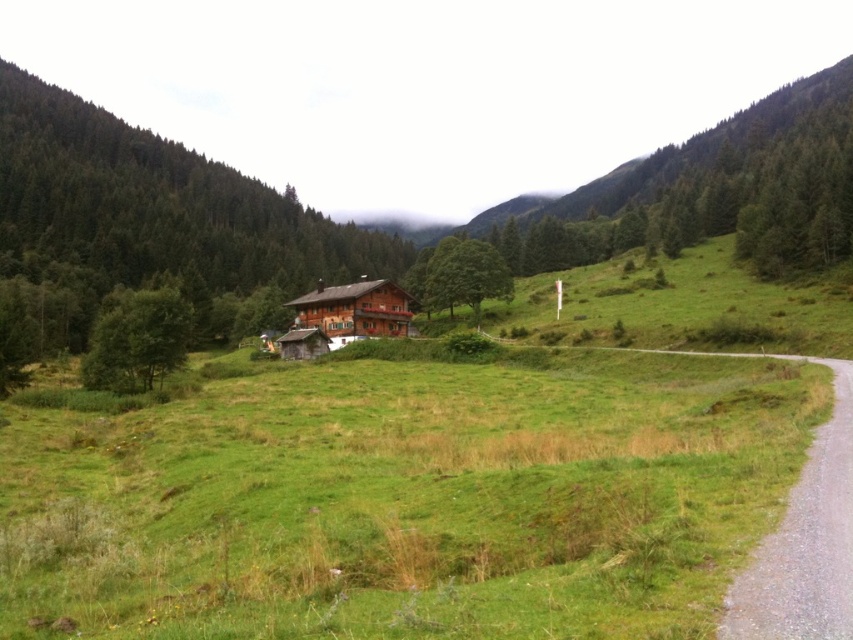
Does green grassy field at center come in front of wooden cabin at center?

Yes, green grassy field at center is in front of wooden cabin at center.

Is green grassy field at center to the left of wooden cabin at center from the viewer's perspective?

Incorrect, green grassy field at center is not on the left side of wooden cabin at center.

Is point (799, 376) more distant than point (300, 310)?

No.

Locate an element on the screen. green grassy field at center is located at coordinates (404, 500).

Can you confirm if green grassy field at center is positioned above green leafy tree at left?

No, green grassy field at center is not above green leafy tree at left.

Is green grassy field at center below green leafy tree at left?

Indeed, green grassy field at center is positioned under green leafy tree at left.

Which is in front, point (511, 440) or point (109, 376)?

Point (511, 440)

Locate an element on the screen. This screenshot has height=640, width=853. green grassy field at center is located at coordinates (404, 500).

The height and width of the screenshot is (640, 853). Describe the element at coordinates (404, 500) in the screenshot. I see `green grassy field at center` at that location.

Image resolution: width=853 pixels, height=640 pixels. In order to click on green grassy field at center in this screenshot , I will do `click(404, 500)`.

The image size is (853, 640). Find the location of `green grassy field at center`. green grassy field at center is located at coordinates (404, 500).